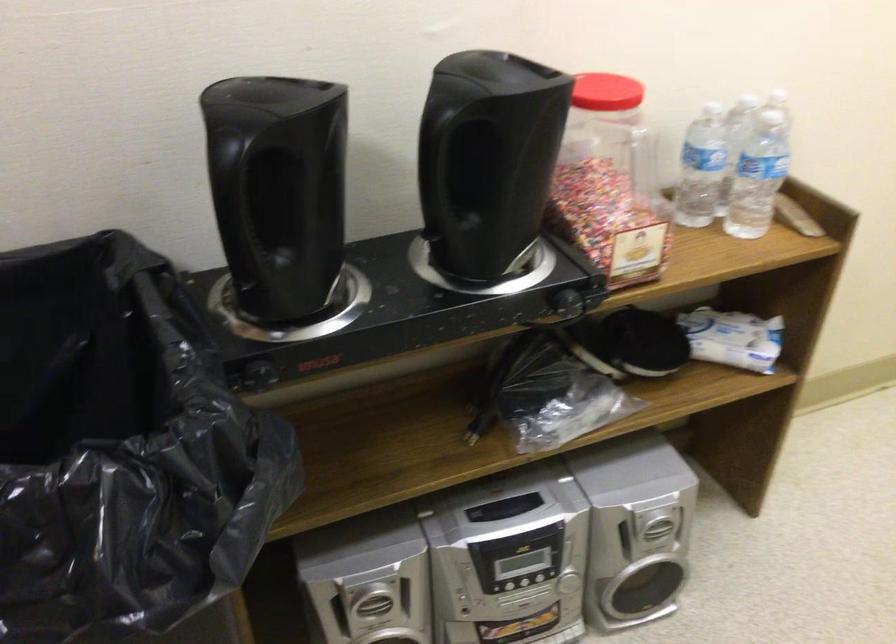
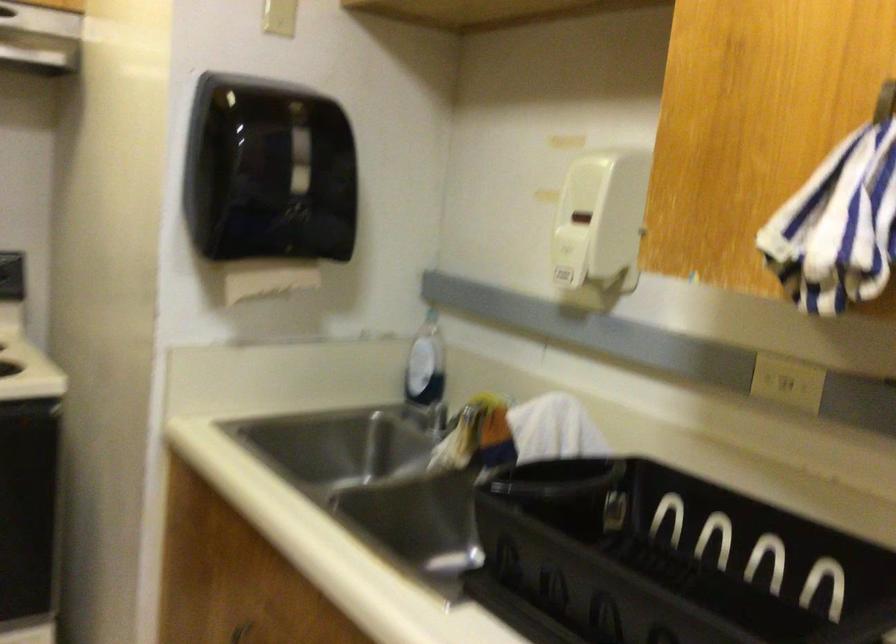
Question: How did the camera likely rotate?

Choices:
 (A) Left
 (B) Right
 (C) Up
 (D) Down

Answer: (A)